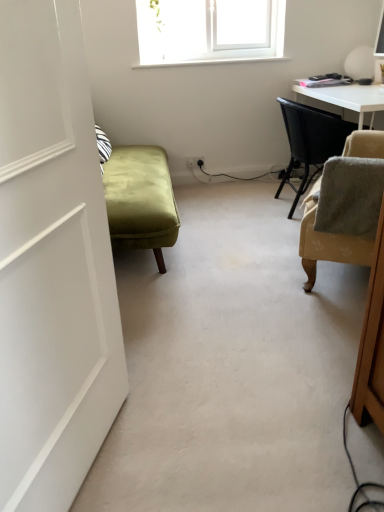
Image resolution: width=384 pixels, height=512 pixels. Find the location of `vacant area located to the right-hand side of white matte door at left`. vacant area located to the right-hand side of white matte door at left is located at coordinates (196, 452).